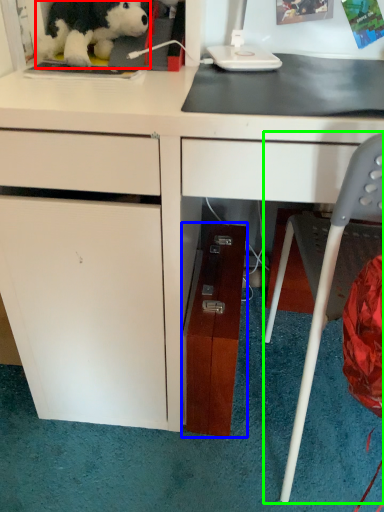
Question: Considering the real-world distances, which object is closest to toy (highlighted by a red box)? file cabinet (highlighted by a blue box) or chair (highlighted by a green box).

Choices:
 (A) file cabinet
 (B) chair

Answer: (A)